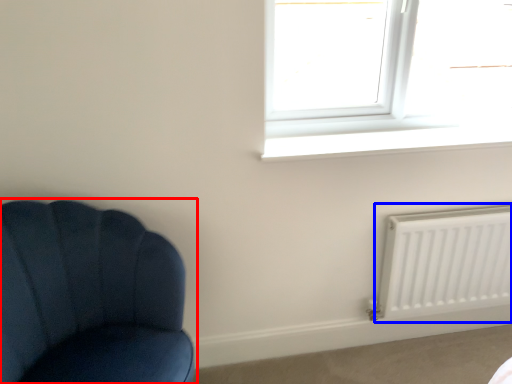
Question: Which object is closer to the camera taking this photo, chair (highlighted by a red box) or radiator (highlighted by a blue box)?

Choices:
 (A) chair
 (B) radiator

Answer: (A)